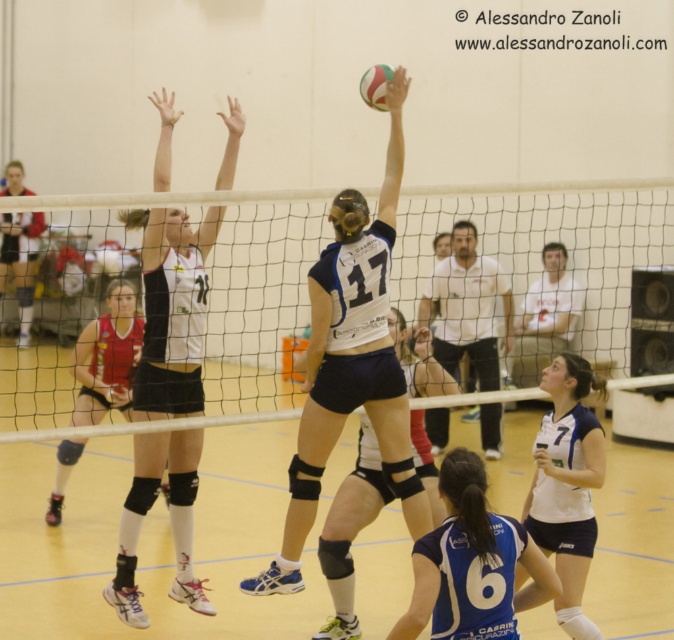
Image resolution: width=674 pixels, height=640 pixels. What do you see at coordinates (350, 362) in the screenshot? I see `white matte volleyball at center` at bounding box center [350, 362].

Between white matte volleyball at center and multicolored rubber volleyball at center, which one is positioned lower?

white matte volleyball at center

The height and width of the screenshot is (640, 674). What do you see at coordinates (350, 362) in the screenshot?
I see `white matte volleyball at center` at bounding box center [350, 362].

At what (x,y) coordinates should I click in order to perform the action: click on white matte volleyball at center. Please return your answer as a coordinate pair (x, y). Looking at the image, I should click on (350, 362).

Between dark blue synthetic shorts at center and matte black shorts at upper left, which one is positioned higher?

matte black shorts at upper left is higher up.

Identify the location of dark blue synthetic shorts at center. (350, 531).

Which is in front, point (338, 589) or point (5, 272)?

Point (338, 589) is more forward.

This screenshot has height=640, width=674. Find the location of `dark blue synthetic shorts at center`. dark blue synthetic shorts at center is located at coordinates (350, 531).

Who is more forward, (22, 234) or (365, 99)?

Point (365, 99) is in front.

How distant is matte black shorts at upper left from multicolored rubber volleyball at center?

matte black shorts at upper left and multicolored rubber volleyball at center are 13.91 meters apart from each other.

Locate an element on the screen. Image resolution: width=674 pixels, height=640 pixels. matte black shorts at upper left is located at coordinates (20, 260).